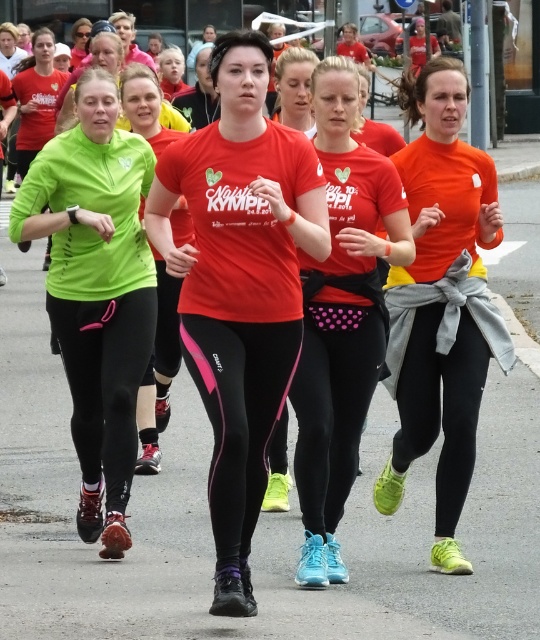
Is matte orange shirt at center smaller than pink dotted leggings at center?

No, matte orange shirt at center is not smaller than pink dotted leggings at center.

Is the position of matte orange shirt at center less distant than that of pink dotted leggings at center?

No.

Between point (459, 248) and point (407, 248), which one is positioned in front?

Point (407, 248) is more forward.

Where is `matte orange shirt at center`? matte orange shirt at center is located at coordinates (442, 301).

Is matte orange shirt at center below green matte leggings at center?

Incorrect, matte orange shirt at center is not positioned below green matte leggings at center.

Which is more to the left, matte orange shirt at center or green matte leggings at center?

From the viewer's perspective, green matte leggings at center appears more on the left side.

Is point (420, 168) farther from viewer compared to point (157, 362)?

No, (420, 168) is closer to viewer.

Identify the location of matte orange shirt at center. (442, 301).

Describe the element at coordinates (239, 285) in the screenshot. I see `matte red shirt at center` at that location.

How distant is matte red shirt at center from green matte leggings at left?

39.31 inches

Is point (254, 81) positioned after point (129, 538)?

No, (254, 81) is in front of (129, 538).

I want to click on matte red shirt at center, so click(x=239, y=285).